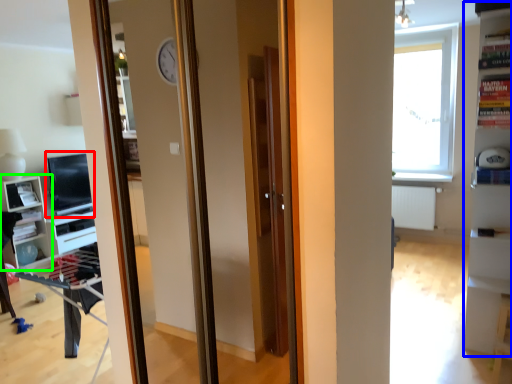
Question: Which is nearer to the computer monitor (highlighted by a red box)? bookshelf (highlighted by a blue box) or shelf (highlighted by a green box).

Choices:
 (A) bookshelf
 (B) shelf

Answer: (B)